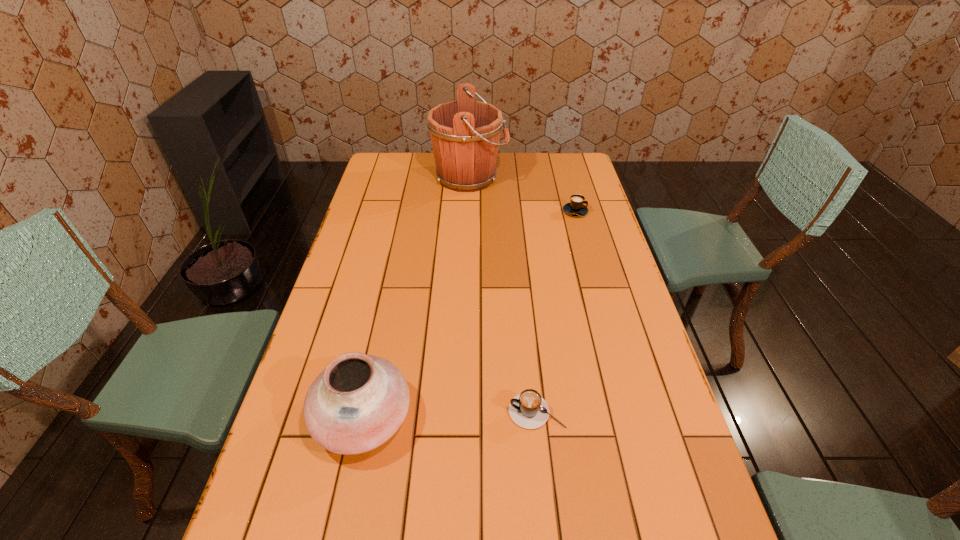
Locate an element on the screen. The image size is (960, 540). the farthest object is located at coordinates (465, 133).

Locate an element on the screen. bucket is located at coordinates (465, 133).

What are the coordinates of `the third shortest object` in the screenshot? It's located at (358, 402).

You are a GUI agent. You are given a task and a screenshot of the screen. Output one action in this format:
    pyautogui.click(x=<x>, y=<y>)
    Task: Click on the rightmost object
    The width and height of the screenshot is (960, 540).
    Given the screenshot: What is the action you would take?
    pyautogui.click(x=576, y=207)

At what (x,y) coordinates should I click in order to perform the action: click on the right cappuccino. Please return your answer as a coordinate pair (x, y). The width and height of the screenshot is (960, 540). Looking at the image, I should click on (576, 207).

Locate an element on the screen. the nearer cappuccino is located at coordinates (529, 410).

Where is `vacant space situated 0.230m with the handle on the side of the bucket`? vacant space situated 0.230m with the handle on the side of the bucket is located at coordinates (563, 177).

Locate an element on the screen. vacant point located 0.320m on the right of the third shortest object is located at coordinates (547, 417).

Where is `vacant space located 0.070m on the front of the farther cappuccino`? This screenshot has height=540, width=960. vacant space located 0.070m on the front of the farther cappuccino is located at coordinates (581, 231).

What are the coordinates of `free location located with the handle on the side of the nearer cappuccino` in the screenshot? It's located at (x=342, y=411).